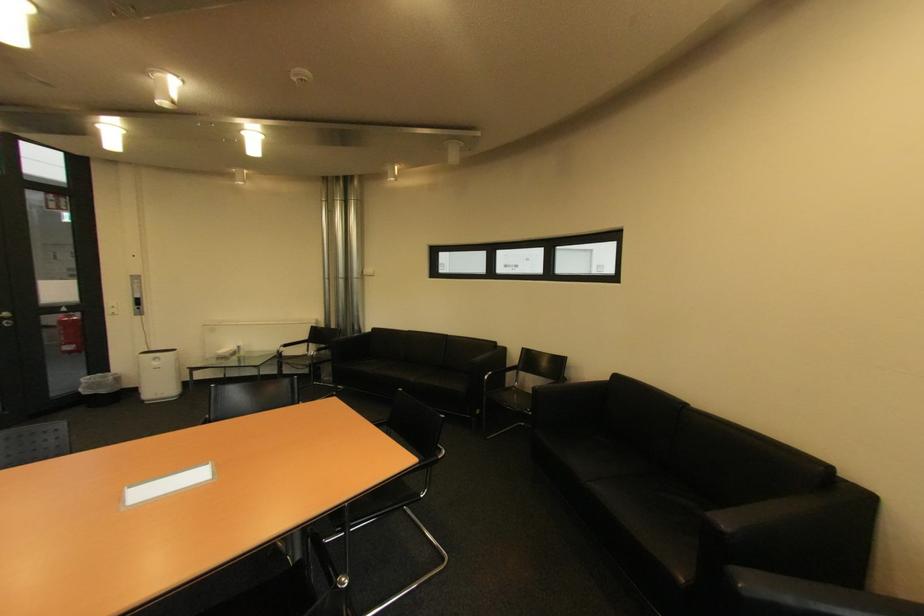
The width and height of the screenshot is (924, 616). I want to click on door handle, so click(6, 318).